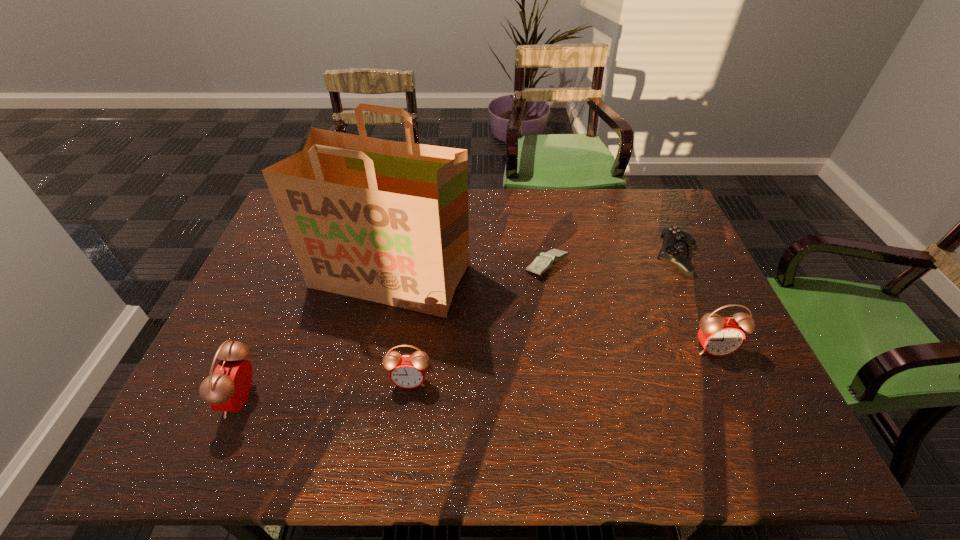
Locate an element on the screen. Image resolution: width=960 pixels, height=540 pixels. vacant space at the near edge of the desktop is located at coordinates (361, 382).

Locate an element on the screen. The image size is (960, 540). free region at the left edge of the desktop is located at coordinates (292, 289).

Identify the location of vacant position at the right edge of the desktop. (686, 298).

Image resolution: width=960 pixels, height=540 pixels. Identify the location of vacant space at the near right corner of the desktop. (714, 405).

The width and height of the screenshot is (960, 540). In order to click on vacant space that's between the leftmost alarm clock and the farthest alarm clock in this screenshot , I will do `click(478, 373)`.

Where is `vacant area between the shortest object and the shortest alarm clock`? The height and width of the screenshot is (540, 960). vacant area between the shortest object and the shortest alarm clock is located at coordinates click(479, 323).

At what (x,y) coordinates should I click in order to perform the action: click on unoccupied area between the second shortest object and the shortest object. Please return your answer as a coordinate pair (x, y). The height and width of the screenshot is (540, 960). Looking at the image, I should click on (612, 262).

Image resolution: width=960 pixels, height=540 pixels. What are the coordinates of `free space between the leftmost alarm clock and the second alarm clock from left to right` in the screenshot? It's located at (326, 390).

Locate an element on the screen. This screenshot has width=960, height=540. free spot between the leftmost object and the fourth object from left to right is located at coordinates (396, 332).

This screenshot has height=540, width=960. In order to click on free space between the second alarm clock from left to right and the second shortest object in this screenshot , I will do `click(543, 320)`.